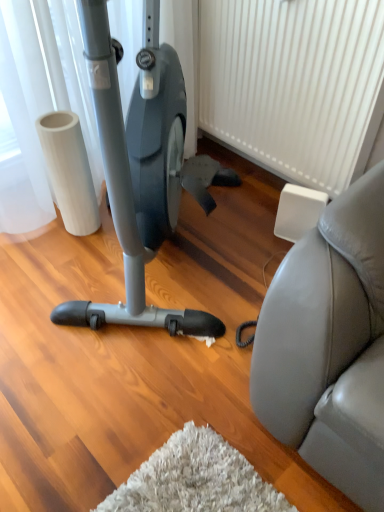
The height and width of the screenshot is (512, 384). In order to click on matte black stationary bicycle at center in this screenshot , I will do `click(139, 168)`.

Describe the element at coordinates (139, 168) in the screenshot. Image resolution: width=384 pixels, height=512 pixels. I see `matte black stationary bicycle at center` at that location.

Where is `white textured radiator at center`? The height and width of the screenshot is (512, 384). white textured radiator at center is located at coordinates (295, 86).

The height and width of the screenshot is (512, 384). What do you see at coordinates (295, 86) in the screenshot?
I see `white textured radiator at center` at bounding box center [295, 86].

The height and width of the screenshot is (512, 384). I want to click on matte black stationary bicycle at center, so click(139, 168).

Between matte black stationary bicycle at center and white textured radiator at center, which one appears on the left side from the viewer's perspective?

From the viewer's perspective, matte black stationary bicycle at center appears more on the left side.

Does matte black stationary bicycle at center lie behind white textured radiator at center?

No, it is in front of white textured radiator at center.

Does point (144, 160) come behind point (258, 49)?

No, (144, 160) is in front of (258, 49).

From the image's perspective, is matte black stationary bicycle at center above white textured radiator at center?

Actually, matte black stationary bicycle at center appears below white textured radiator at center in the image.

From a real-world perspective, which object rests below the other?

white textured radiator at center is physically lower.

In terms of width, does matte black stationary bicycle at center look wider or thinner when compared to white textured radiator at center?

Clearly, matte black stationary bicycle at center has more width compared to white textured radiator at center.

Does matte black stationary bicycle at center have a greater height compared to white textured radiator at center?

Indeed, matte black stationary bicycle at center has a greater height compared to white textured radiator at center.

Is matte black stationary bicycle at center bigger than white textured radiator at center?

Correct, matte black stationary bicycle at center is larger in size than white textured radiator at center.

Is matte black stationary bicycle at center located outside white textured radiator at center?

Yes, matte black stationary bicycle at center is outside of white textured radiator at center.

Is matte black stationary bicycle at center not near white textured radiator at center?

matte black stationary bicycle at center is near white textured radiator at center, not far away.

Is matte black stationary bicycle at center facing away from white textured radiator at center?

matte black stationary bicycle at center is not turned away from white textured radiator at center.

How different are the orientations of matte black stationary bicycle at center and white textured radiator at center in degrees?

There is a 40.4-degree angle between the facing directions of matte black stationary bicycle at center and white textured radiator at center.

I want to click on stationary bicycle in front of the white textured radiator at center, so click(139, 168).

Consider the image. Which is more to the right, white textured radiator at center or matte black stationary bicycle at center?

white textured radiator at center is more to the right.

Between white textured radiator at center and matte black stationary bicycle at center, which one is positioned behind?

white textured radiator at center is behind.

Is point (251, 99) farther from camera compared to point (163, 239)?

Yes, it is.

From the image's perspective, is white textured radiator at center positioned above or below matte black stationary bicycle at center?

white textured radiator at center is above matte black stationary bicycle at center.

From a real-world perspective, is white textured radiator at center physically below matte black stationary bicycle at center?

Yes, from a real-world perspective, white textured radiator at center is under matte black stationary bicycle at center.

Can you confirm if white textured radiator at center is thinner than matte black stationary bicycle at center?

Correct, the width of white textured radiator at center is less than that of matte black stationary bicycle at center.

Does white textured radiator at center have a lesser height compared to matte black stationary bicycle at center?

Yes, white textured radiator at center is shorter than matte black stationary bicycle at center.

Based on their sizes in the image, would you say white textured radiator at center is bigger or smaller than matte black stationary bicycle at center?

Considering their sizes, white textured radiator at center takes up less space than matte black stationary bicycle at center.

Is white textured radiator at center positioned beyond the bounds of matte black stationary bicycle at center?

A: Yes, white textured radiator at center is located beyond the bounds of matte black stationary bicycle at center.

Is white textured radiator at center positioned far away from matte black stationary bicycle at center?

They are positioned close to each other.

From the picture: Is matte black stationary bicycle at center at the back of white textured radiator at center?

Yes, matte black stationary bicycle at center is at the back of white textured radiator at center.

Looking at this image, how different are the orientations of white textured radiator at center and matte black stationary bicycle at center in degrees?

40.4 degrees separate the facing orientations of white textured radiator at center and matte black stationary bicycle at center.

How far apart are white textured radiator at center and matte black stationary bicycle at center?

21.47 inches.

Find the location of `radiator behind the matte black stationary bicycle at center`. radiator behind the matte black stationary bicycle at center is located at coordinates pos(295,86).

Locate an element on the screen. Image resolution: width=384 pixels, height=512 pixels. radiator above the matte black stationary bicycle at center (from the image's perspective) is located at coordinates coord(295,86).

The height and width of the screenshot is (512, 384). Find the location of `stationary bicycle located on the left of white textured radiator at center`. stationary bicycle located on the left of white textured radiator at center is located at coordinates (139, 168).